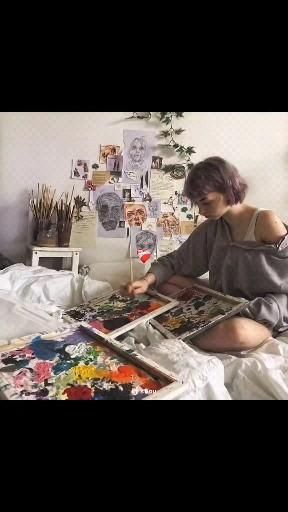
Image resolution: width=288 pixels, height=512 pixels. I want to click on vase, so click(x=40, y=224), click(x=66, y=226).